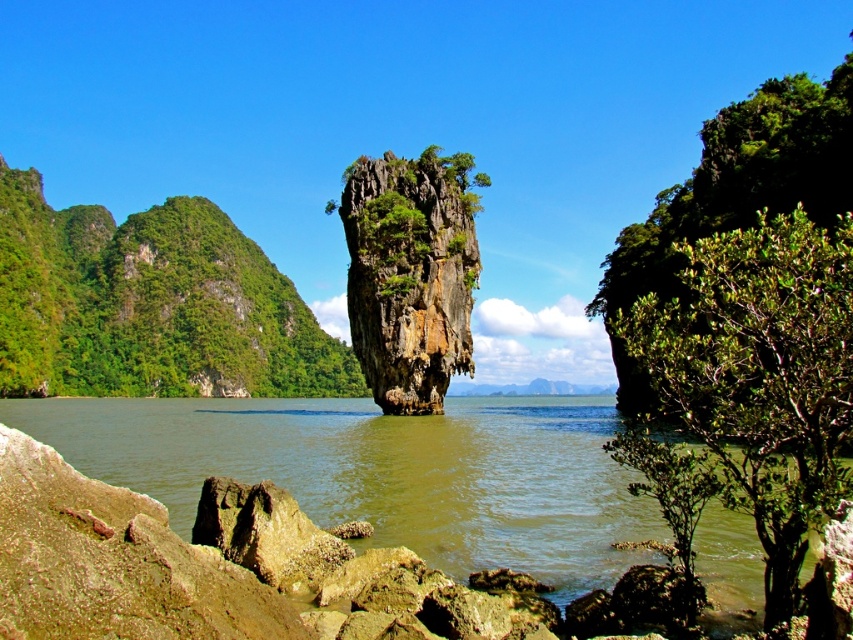
Question: Which object is farther from the camera taking this photo?

Choices:
 (A) green leafy shrub at right
 (B) greenish water at center

Answer: (B)

Question: Can you confirm if green leafy shrub at right is thinner than rusty brown rock at center?

Choices:
 (A) no
 (B) yes

Answer: (A)

Question: In this image, where is green leafy shrub at right located relative to rusty brown rock at center?

Choices:
 (A) left
 (B) right

Answer: (B)

Question: Considering the relative positions of green leafy tree at left and rusty brown rock at center in the image provided, where is green leafy tree at left located with respect to rusty brown rock at center?

Choices:
 (A) above
 (B) below

Answer: (A)

Question: Based on their relative distances, which object is farther from the green leafy tree at left?

Choices:
 (A) green leafy shrub at right
 (B) greenish water at center

Answer: (A)

Question: Which object is positioned farthest from the greenish water at center?

Choices:
 (A) green leafy shrub at right
 (B) green leafy tree at left

Answer: (B)